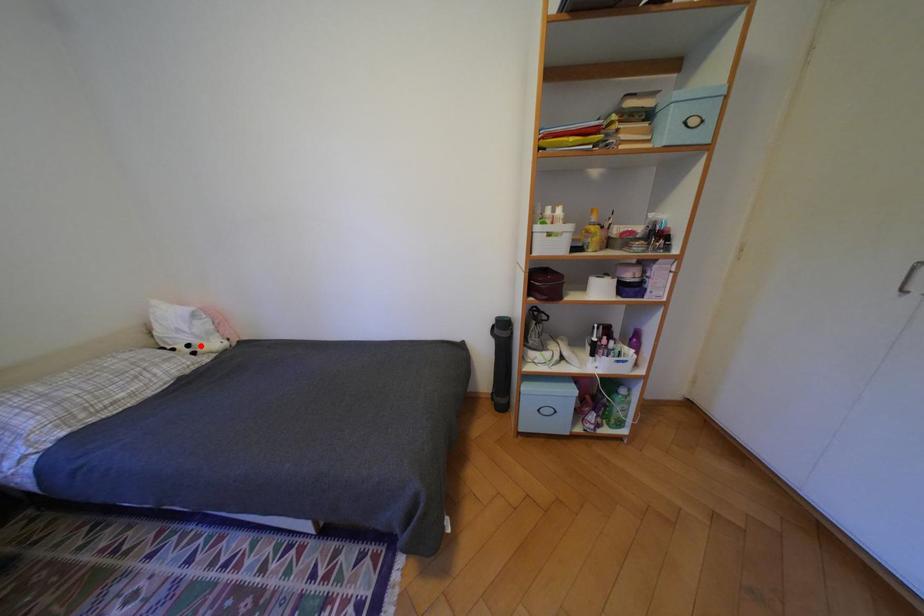
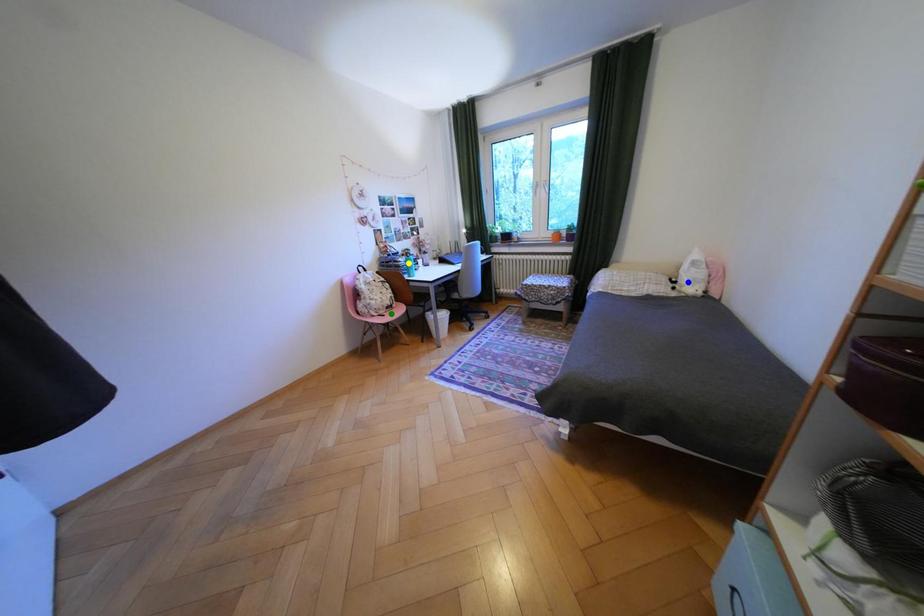
Question: I am providing you with two images of the same scene from different viewpoints. A red point is marked on the first image. You are given multiple points on the second image. In image 2, which mark is for the same physical point as the one in image 1?

Choices:
 (A) yellow point
 (B) green point
 (C) blue point

Answer: (C)